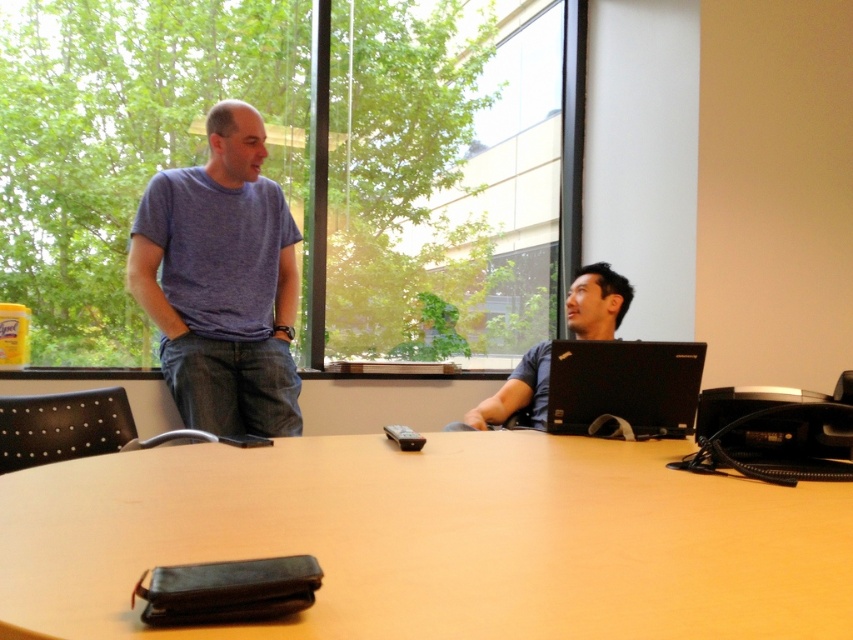
Is transparent glass window at upper center positioned behind matte black laptop at right?

Yes, it is.

Between point (165, 284) and point (505, 388), which one is positioned in front?

Point (505, 388)

Find the location of `transparent glass window at upper center`. transparent glass window at upper center is located at coordinates (303, 164).

Which is behind, point (32, 632) or point (277, 372)?

Point (277, 372)

Does light brown wooden table at center have a lesser width compared to matte blue t-shirt at left?

Incorrect, light brown wooden table at center's width is not less than matte blue t-shirt at left's.

Between point (537, 545) and point (207, 413), which one is positioned in front?

Point (537, 545) is more forward.

The width and height of the screenshot is (853, 640). I want to click on light brown wooden table at center, so click(434, 540).

Is light brown wooden table at center thinner than black matte laptop at right?

No.

This screenshot has height=640, width=853. Describe the element at coordinates (434, 540) in the screenshot. I see `light brown wooden table at center` at that location.

Describe the element at coordinates (434, 540) in the screenshot. I see `light brown wooden table at center` at that location.

At what (x,y) coordinates should I click in order to perform the action: click on light brown wooden table at center. Please return your answer as a coordinate pair (x, y). Image resolution: width=853 pixels, height=640 pixels. Looking at the image, I should click on (434, 540).